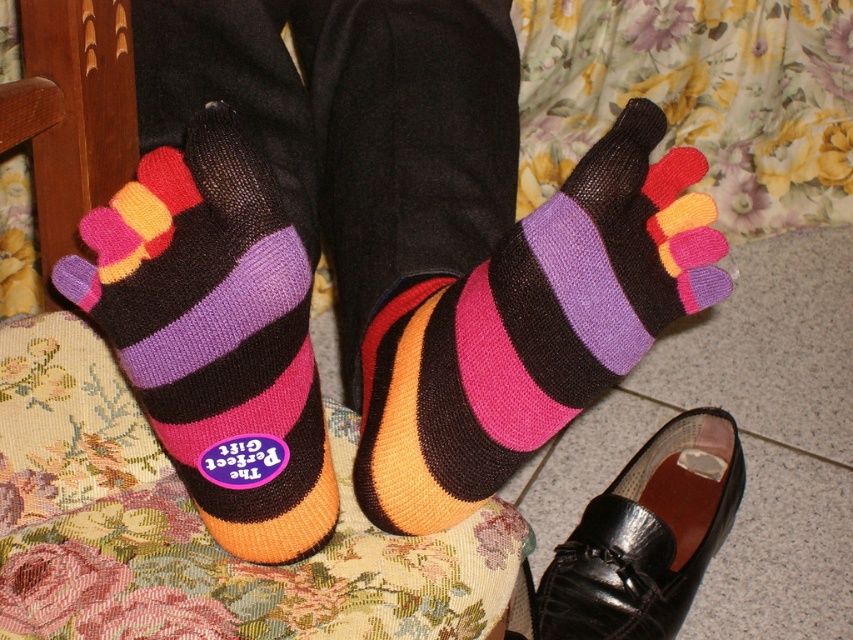
Question: Which object is positioned closest to the knitted striped socks at center?

Choices:
 (A) black leather shoe at lower right
 (B) knitted striped sock at center
 (C) multicolored knitted sock at center

Answer: (B)

Question: Does knitted striped sock at center lie in front of black leather shoe at lower right?

Choices:
 (A) no
 (B) yes

Answer: (B)

Question: Does knitted striped socks at center have a smaller size compared to knitted striped sock at center?

Choices:
 (A) no
 (B) yes

Answer: (A)

Question: Observing the image, what is the correct spatial positioning of knitted striped socks at center in reference to knitted striped sock at center?

Choices:
 (A) below
 (B) above

Answer: (B)

Question: Which of the following is the closest to the observer?

Choices:
 (A) [395, 376]
 (B) [666, 508]

Answer: (A)

Question: Which point appears farthest from the camera in this image?

Choices:
 (A) (473, 172)
 (B) (280, 403)

Answer: (A)